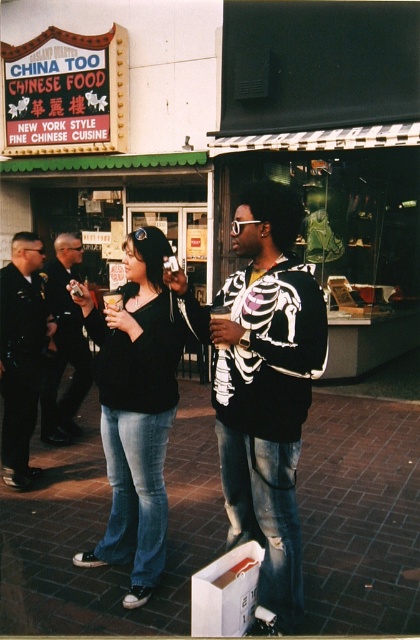
This screenshot has height=640, width=420. What do you see at coordinates (267, 387) in the screenshot?
I see `matte black skeleton shirt at center` at bounding box center [267, 387].

Is point (296, 582) farther from camera compared to point (5, 353)?

No, it is in front of (5, 353).

Image resolution: width=420 pixels, height=640 pixels. I want to click on matte black skeleton shirt at center, so click(x=267, y=387).

Does black matte shirt at center have a greater width compared to dark blue uniform at center?

Correct, the width of black matte shirt at center exceeds that of dark blue uniform at center.

At what (x,y) coordinates should I click in order to perform the action: click on black matte shirt at center. Please return your answer as a coordinate pair (x, y). Image resolution: width=420 pixels, height=640 pixels. Looking at the image, I should click on (262, 387).

Identify the location of black matte shirt at center. This screenshot has width=420, height=640. (262, 387).

Is the position of matte black skeleton shirt at center less distant than that of denim jeans at center?

Yes, matte black skeleton shirt at center is closer to the viewer.

Is matte black skeleton shirt at center below denim jeans at center?

Actually, matte black skeleton shirt at center is above denim jeans at center.

Locate an element on the screen. This screenshot has height=640, width=420. matte black skeleton shirt at center is located at coordinates (267, 387).

I want to click on matte black skeleton shirt at center, so click(267, 387).